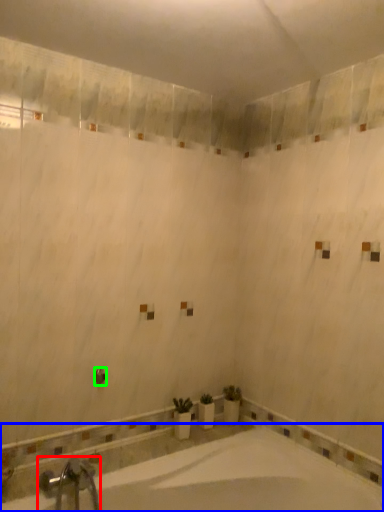
Question: Which object is positioned farthest from tap (highlighted by a red box)? Select from bathtub (highlighted by a blue box) and shower (highlighted by a green box).

Choices:
 (A) bathtub
 (B) shower

Answer: (B)